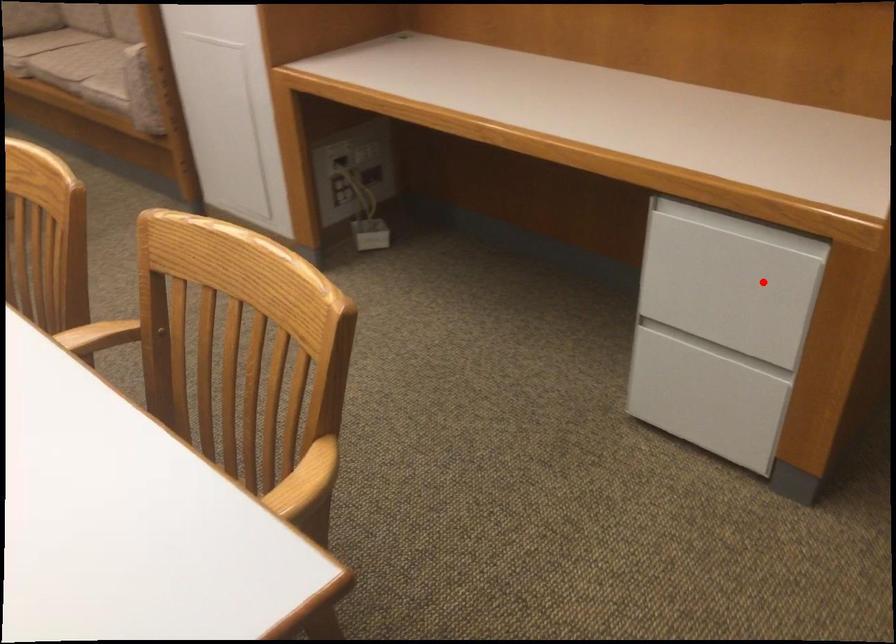
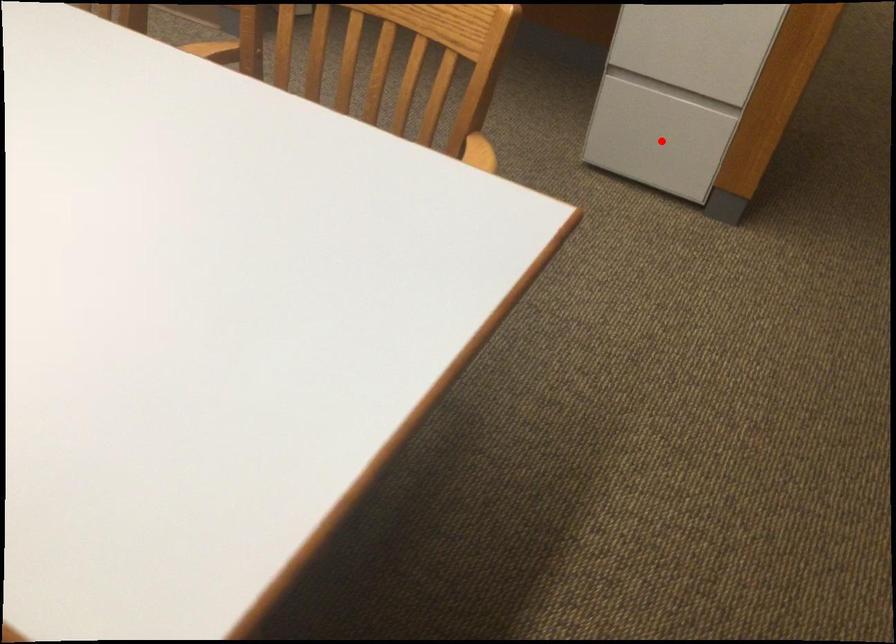
I am providing you with two images of the same scene from different viewpoints. A red point is marked on the first image and another point is marked on the second image. Is the red point in image1 aligned with the point shown in image2?

No